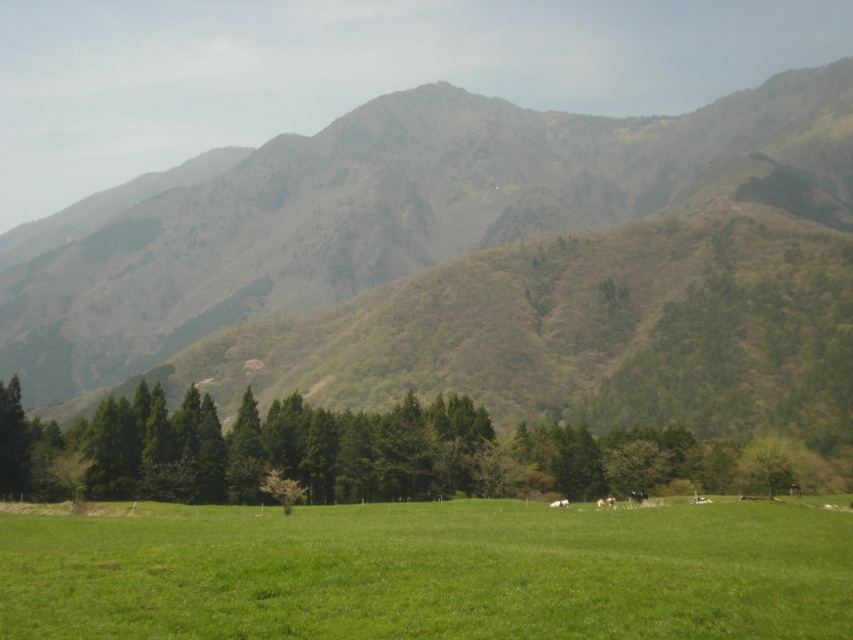
You are a hiker trying to decide between two paths in the rural landscape. One path leads to the green grassy hillside at center and the other to the green grass pasture at center. If you want to choose the larger area to explore, which path should you take?

The green grassy hillside at center is bigger than the green grass pasture at center, so you should take the path to the green grassy hillside at center.

Looking at this image, you are standing in the rural landscape and want to walk from the green textured trees at center to the green grass pasture at center. Which direction should you face to walk directly towards it?

You should face to the right to walk directly towards the green grass pasture at center since it is located to the right of the green textured trees at center.